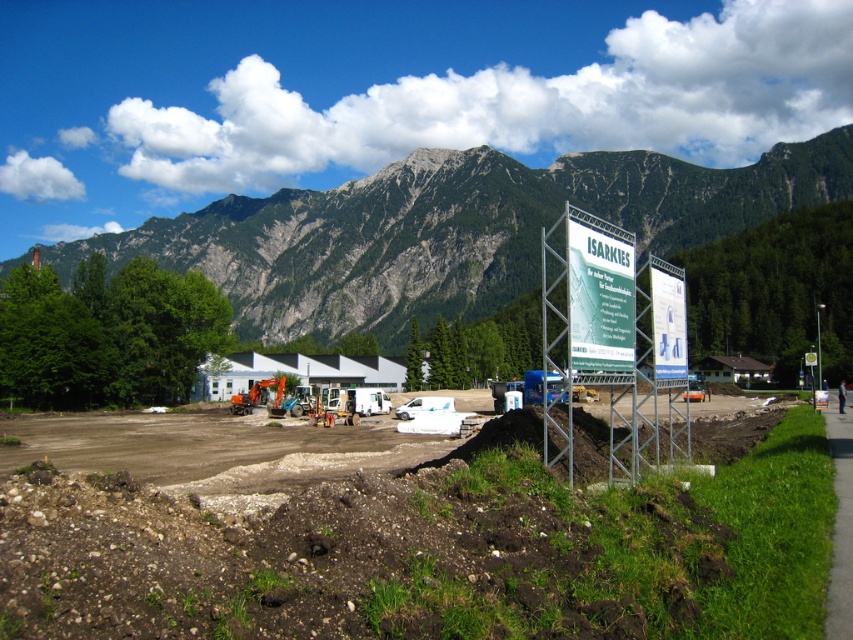
Is green plastic sign at center below black fabric construction worker at lower right?

No.

Find the location of a particular element. Image resolution: width=853 pixels, height=640 pixels. green plastic sign at center is located at coordinates (599, 292).

Which is above, white plastic sign at center-right or orange metallic construction equipment at center?

Positioned higher is white plastic sign at center-right.

Between white plastic sign at center-right and orange metallic construction equipment at center, which one has more height?

white plastic sign at center-right

Between point (666, 301) and point (231, 412), which one is positioned in front?

Point (666, 301) is in front.

Image resolution: width=853 pixels, height=640 pixels. Find the location of `white plastic sign at center-right`. white plastic sign at center-right is located at coordinates 668,324.

Between point (834, 132) and point (241, 397), which one is positioned behind?

The point (834, 132) is behind.

Is point (218, 278) farther from camera compared to point (277, 385)?

Yes, point (218, 278) is behind point (277, 385).

Locate an element on the screen. rocky gray mountain at upper center is located at coordinates (451, 230).